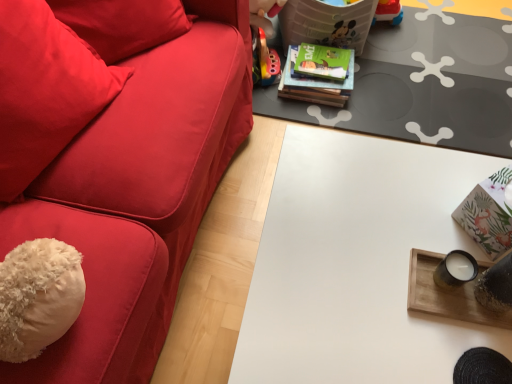
Question: Is there a large distance between white matte table at center, which ranks as the first table in bottom-to-top order, and wooden tray at right, positioned as the 2th table in back-to-front order?

Choices:
 (A) yes
 (B) no

Answer: (B)

Question: Is white matte table at center, which ranks as the 3th table in back-to-front order, shorter than wooden tray at right, the second table in the bottom-to-top sequence?

Choices:
 (A) yes
 (B) no

Answer: (B)

Question: From the image's perspective, is white matte table at center, which ranks as the first table in bottom-to-top order, over wooden tray at right, the second table in the bottom-to-top sequence?

Choices:
 (A) yes
 (B) no

Answer: (B)

Question: Is white matte table at center, the first table when ordered from front to back, to the right of wooden tray at right, the second table in the bottom-to-top sequence, from the viewer's perspective?

Choices:
 (A) yes
 (B) no

Answer: (B)

Question: Would you say white matte table at center, the first table when ordered from front to back, is outside wooden tray at right, positioned as the 2th table in back-to-front order?

Choices:
 (A) yes
 (B) no

Answer: (A)

Question: Can you confirm if white matte table at center, the 3th table when ordered from top to bottom, is smaller than wooden tray at right, the second table in the bottom-to-top sequence?

Choices:
 (A) yes
 (B) no

Answer: (B)

Question: Is white matte table at center, the first table when ordered from front to back, outside green matte book at upper center?

Choices:
 (A) no
 (B) yes

Answer: (B)

Question: Can you confirm if white matte table at center, the first table when ordered from front to back, is positioned to the left of green matte book at upper center?

Choices:
 (A) yes
 (B) no

Answer: (B)

Question: Does white matte table at center, the 3th table when ordered from top to bottom, turn towards green matte book at upper center?

Choices:
 (A) yes
 (B) no

Answer: (B)

Question: From the image's perspective, is white matte table at center, which ranks as the 3th table in back-to-front order, over green matte book at upper center?

Choices:
 (A) no
 (B) yes

Answer: (A)

Question: Does white matte table at center, the first table when ordered from front to back, have a greater height compared to green matte book at upper center?

Choices:
 (A) yes
 (B) no

Answer: (A)

Question: Considering the relative sizes of green matte book at upper center and white matte table at center, the first table when ordered from front to back, in the image provided, is green matte book at upper center taller than white matte table at center, the first table when ordered from front to back,?

Choices:
 (A) no
 (B) yes

Answer: (A)